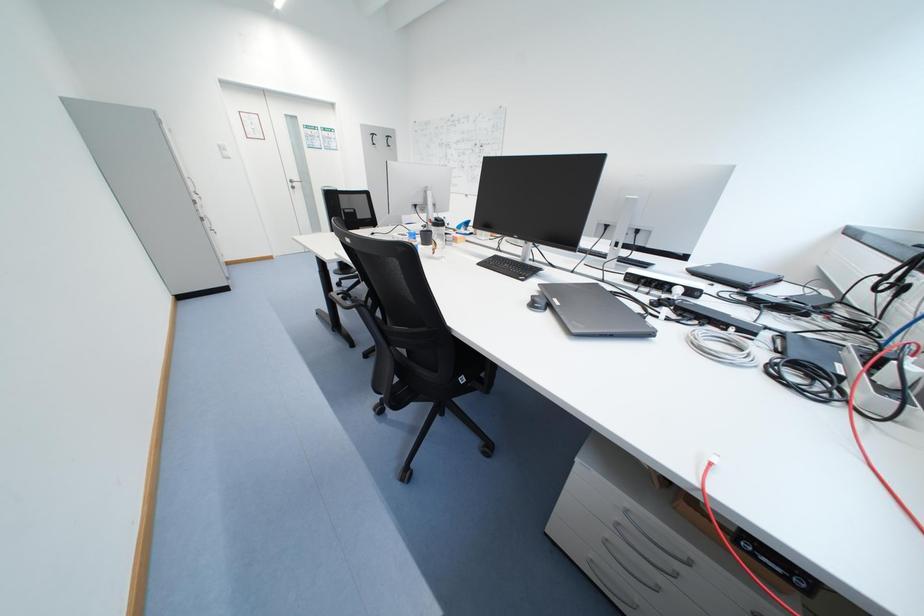
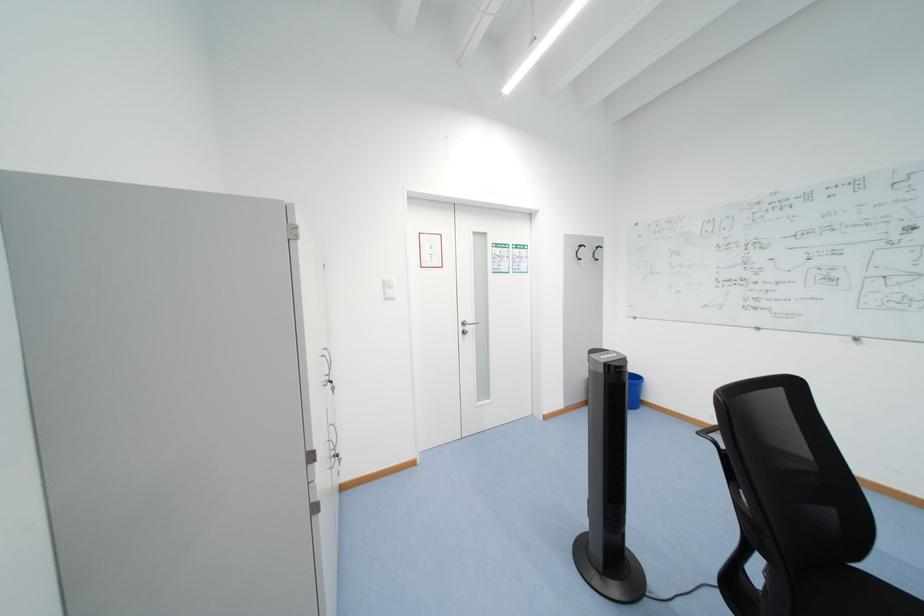
What movement of the cameraman would produce the second image?

The movement direction of the cameraman is left, forward.